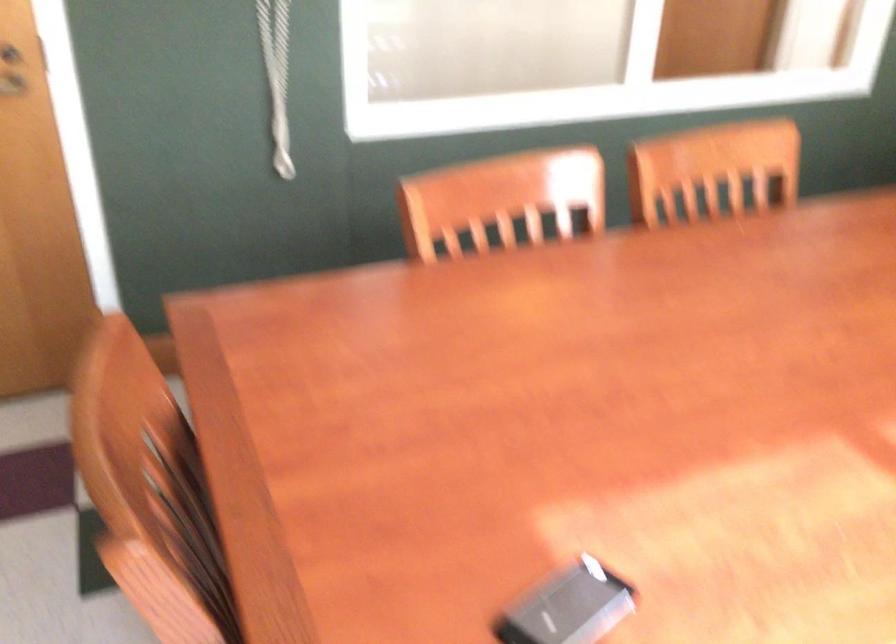
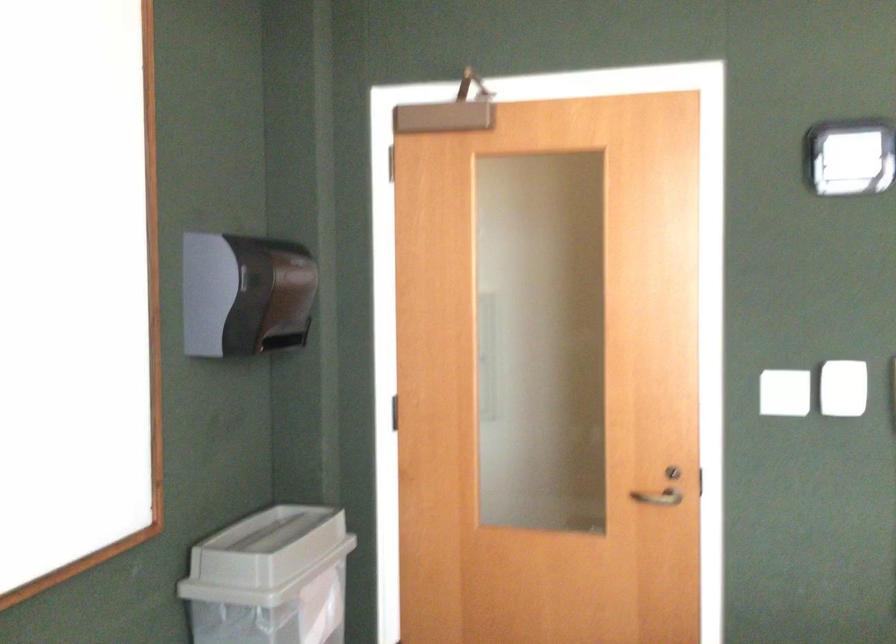
The images are taken continuously from a first-person perspective. In which direction is your viewpoint rotating?

The rotation direction of the camera is left-up.